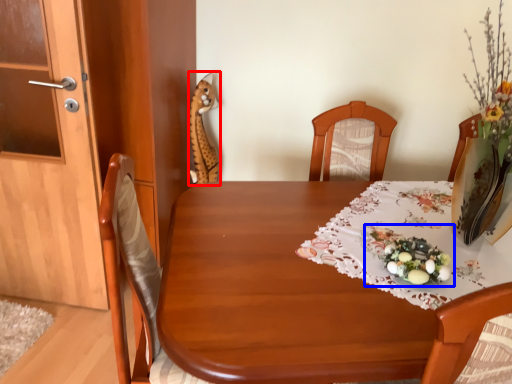
Question: Which point is closer to the camera, animal (highlighted by a red box) or floral arrangement (highlighted by a blue box)?

Choices:
 (A) animal
 (B) floral arrangement

Answer: (B)